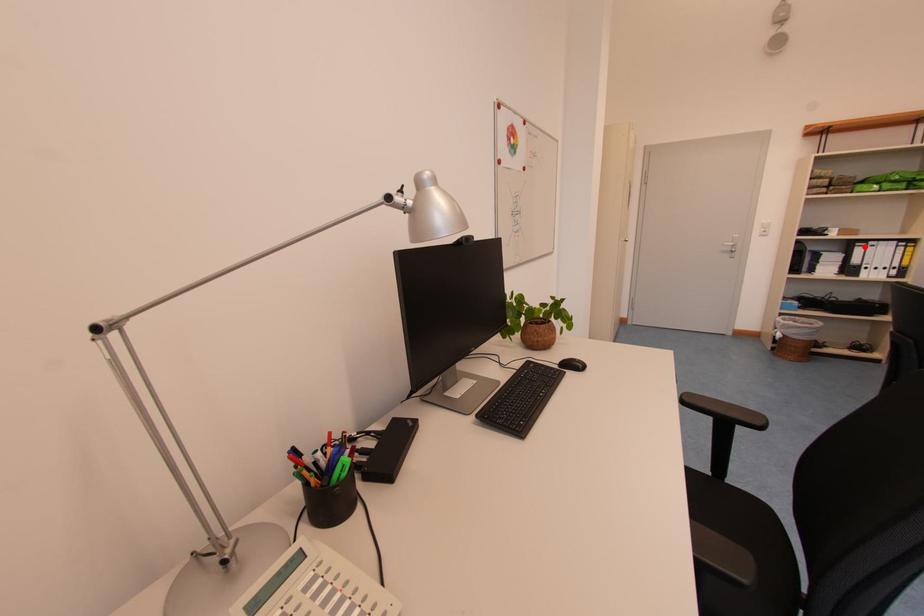
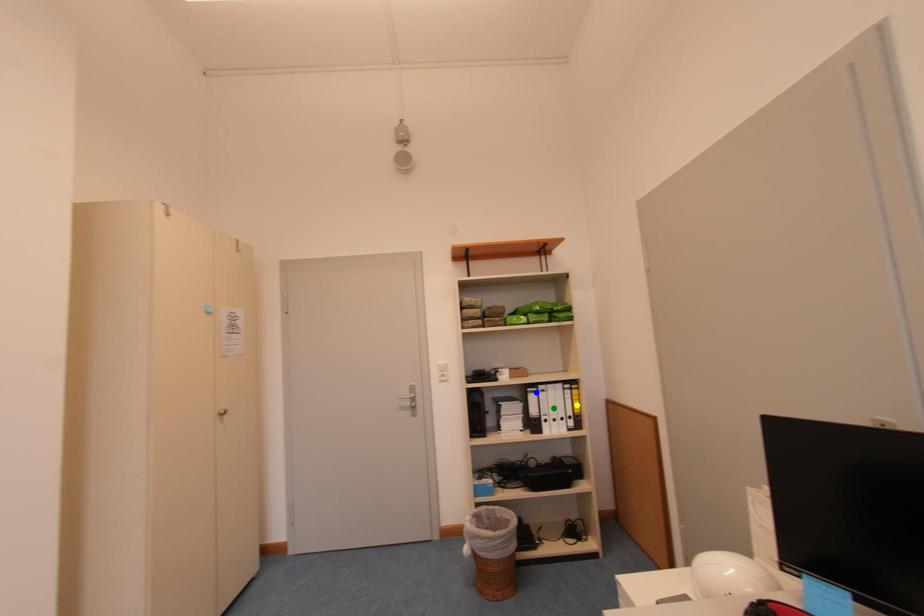
Question: I am providing you with two images of the same scene from different viewpoints. A red point is marked on the first image. You are given multiple points on the second image. Which spot in image 2 lines up with the point in image 1?

Choices:
 (A) yellow point
 (B) blue point
 (C) green point

Answer: (B)